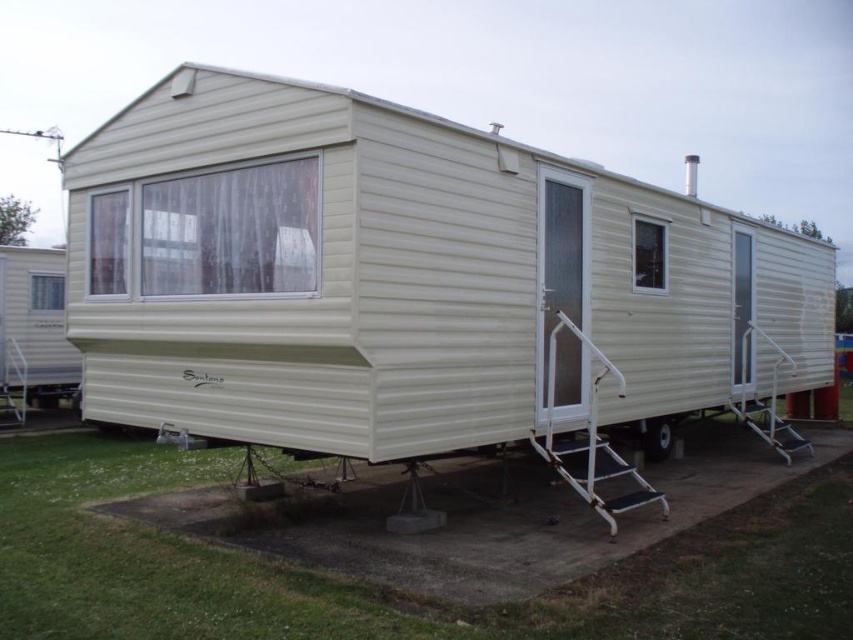
Question: Which of the following is the farthest from the observer?

Choices:
 (A) white plastic ladder at center
 (B) white metallic ladder at right

Answer: (B)

Question: Does white metallic ladder at right appear over white metallic ladder at lower left?

Choices:
 (A) yes
 (B) no

Answer: (A)

Question: Is white metallic ladder at right above black rubber wheel at lower right?

Choices:
 (A) yes
 (B) no

Answer: (A)

Question: Which object is positioned farthest from the black rubber wheel at lower right?

Choices:
 (A) beige corrugated metal trailer at center
 (B) white plastic ladder at center
 (C) white metallic ladder at right
 (D) white metallic ladder at lower left

Answer: (D)

Question: Which is farther from the white metallic ladder at lower left?

Choices:
 (A) black rubber wheel at lower right
 (B) white metallic ladder at right
 (C) white plastic ladder at center
 (D) beige corrugated metal trailer at center

Answer: (B)

Question: Is beige corrugated metal trailer at center wider than white metallic ladder at lower left?

Choices:
 (A) yes
 (B) no

Answer: (A)